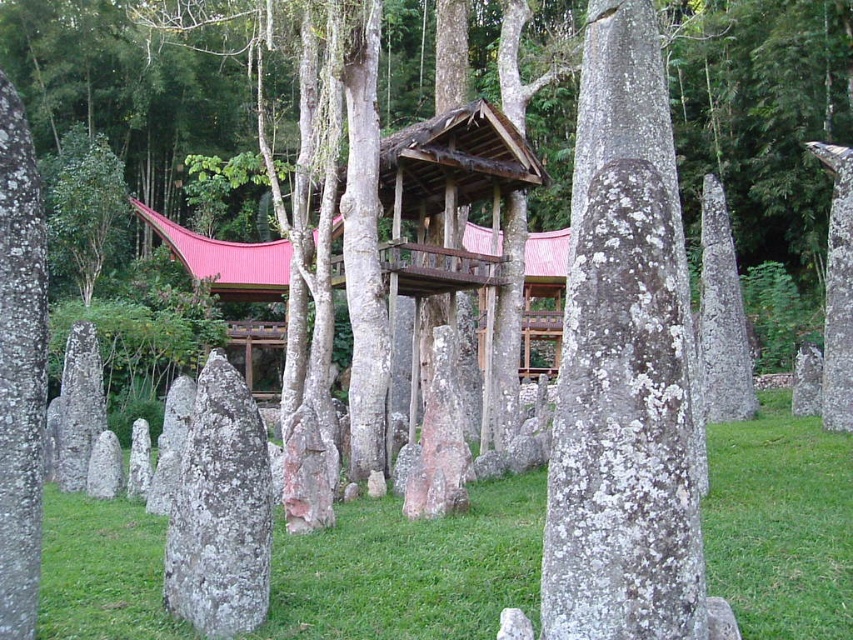
Question: Is lichen-covered stone at center closer to the viewer compared to green leafy tree at left?

Choices:
 (A) no
 (B) yes

Answer: (B)

Question: Which object is closer to the camera taking this photo?

Choices:
 (A) pinkish-white lichen-covered rock at center
 (B) green leafy tree at left

Answer: (A)

Question: Does green grass at center have a lesser width compared to lichen-covered stone at center?

Choices:
 (A) yes
 (B) no

Answer: (B)

Question: Which point is farther to the camera?

Choices:
 (A) green grass at center
 (B) lichen-covered stone at center
 (C) pinkish-white lichen-covered rock at center
 (D) green leafy tree at left

Answer: (D)

Question: Where is green grass at center located in relation to pinkish-white lichen-covered rock at center in the image?

Choices:
 (A) right
 (B) left

Answer: (A)

Question: Which point is farther to the camera?

Choices:
 (A) green grass at center
 (B) green leafy tree at left
 (C) pinkish-white lichen-covered rock at center
 (D) lichen-covered stone at center

Answer: (B)